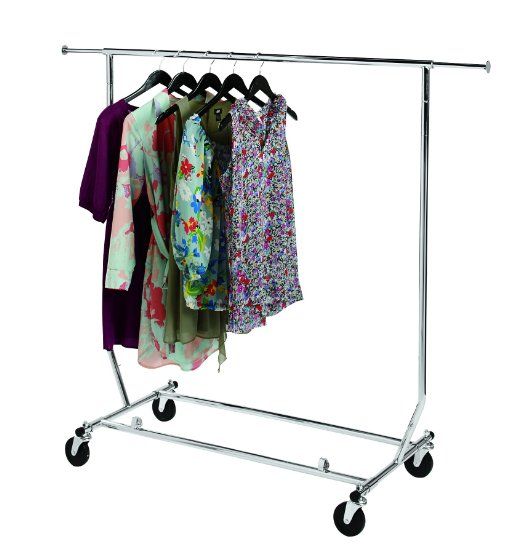
At what (x,y) coordinates should I click in order to perform the action: click on metal hanging hook. Please return your answer as a coordinate pair (x, y). Looking at the image, I should click on (256, 55), (230, 55), (205, 54), (176, 53), (155, 52).